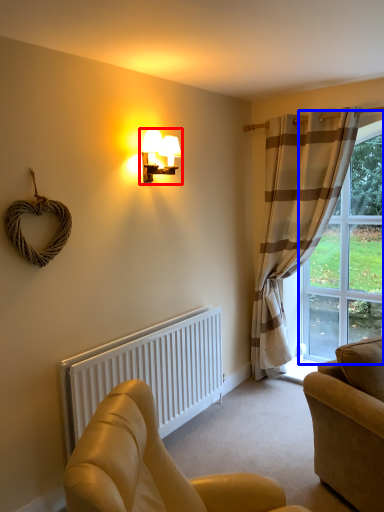
Question: Which of the following is the closest to the observer, lamp (highlighted by a red box) or window (highlighted by a blue box)?

Choices:
 (A) lamp
 (B) window

Answer: (A)